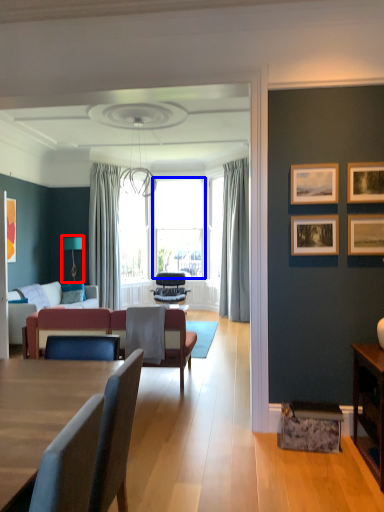
Question: Which of the following is the farthest to the observer, lamp (highlighted by a red box) or window screen (highlighted by a blue box)?

Choices:
 (A) lamp
 (B) window screen

Answer: (B)